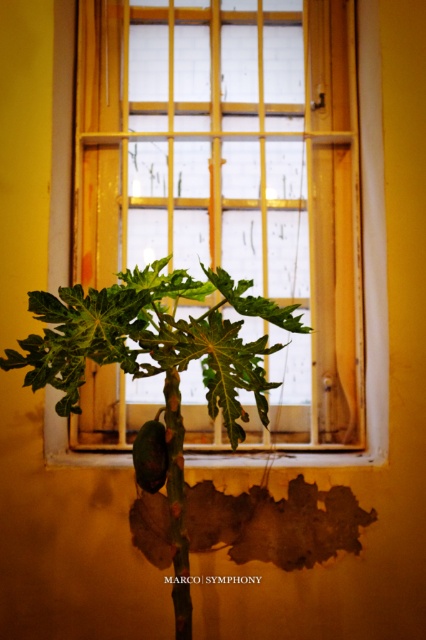
Based on the photo, you are standing in front of the papaya plant and want to touch the point at coordinates point (196, 296). Can you reach it without moving your body?

The point (196, 296) is 1.92 meters from the viewer, so yes, you can reach it without moving your body if your arm can extend that far.

You are a gardener who wants to water the plant in the image. The watering can is placed at point A, which is at the bottom left corner of the image. You need to move from point A to the plant. Which direction should you move first? The plant is located at point B, which is indicated by the coordinates point [155,340]. Please choose between left, right, up, or down.

The point [155,340] indicates the green matte leafy plant at center, so you should move up and right from point A at the bottom left corner to reach the plant.

You are a gardener who wants to place a 20 inch ruler horizontally between the green matte leafy plant at center and the wooden frame at center. Can the ruler fit without overlapping either object?

The distance between the green matte leafy plant at center and the wooden frame at center is 19.30 inches, so the 20 inch ruler cannot fit without overlapping the objects since it is longer than the space available.